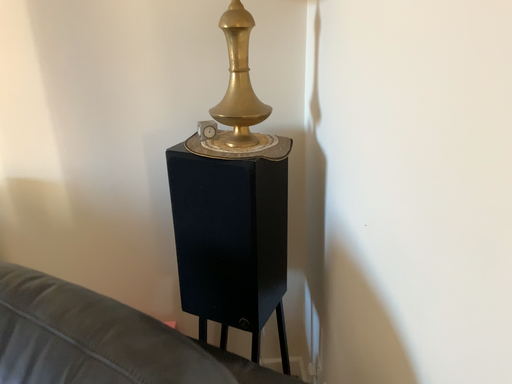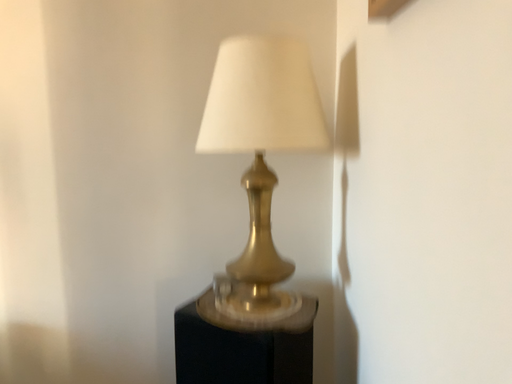
Question: How did the camera likely rotate when shooting the video?

Choices:
 (A) rotated downward
 (B) rotated upward

Answer: (B)